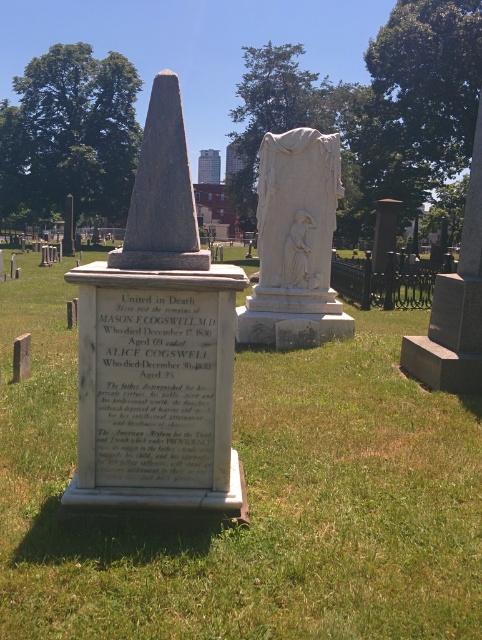
Is point (146, 330) positioned behind point (430, 321)?

No, it is in front of (430, 321).

Which is in front, point (106, 404) or point (444, 362)?

Positioned in front is point (106, 404).

The image size is (482, 640). What do you see at coordinates (158, 346) in the screenshot?
I see `white marble obelisk at center` at bounding box center [158, 346].

The width and height of the screenshot is (482, 640). I want to click on white marble obelisk at center, so click(158, 346).

Does point (338, 172) come closer to viewer compared to point (474, 380)?

No, (338, 172) is behind (474, 380).

Is white marble statue at center behind smooth gray stone monument at center?

Yes, white marble statue at center is behind smooth gray stone monument at center.

Does point (333, 202) come farther from viewer compared to point (427, 339)?

Yes, it is.

Find the location of a particular element. Image resolution: width=482 pixels, height=640 pixels. white marble statue at center is located at coordinates (295, 243).

Measure the distance between white marble obelisk at center and camera.

white marble obelisk at center is 3.35 meters away from camera.

The height and width of the screenshot is (640, 482). I want to click on white marble obelisk at center, so click(x=158, y=346).